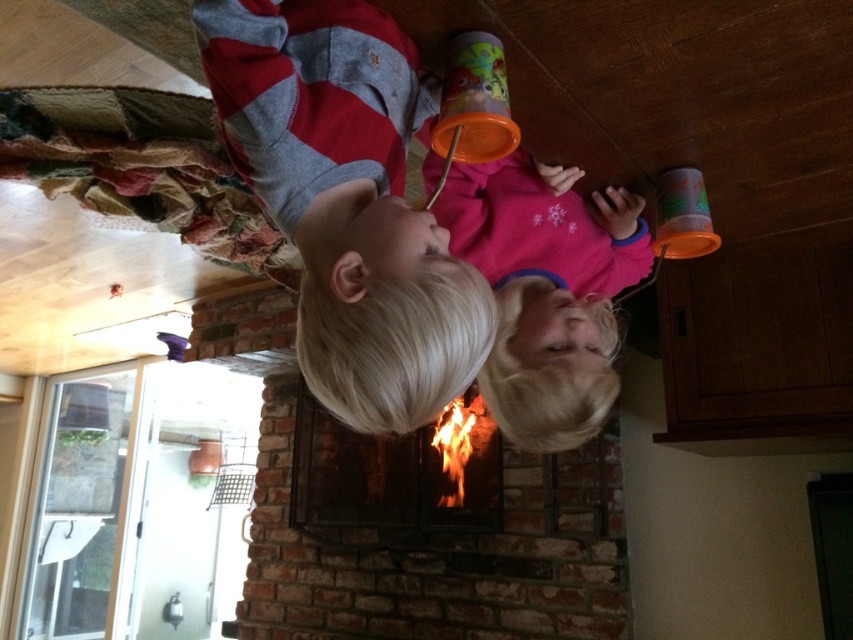
Is point (496, 253) closer to camera compared to point (440, 512)?

Yes, it is in front of point (440, 512).

This screenshot has width=853, height=640. What are the coordinates of `pink fleece sweater at center` in the screenshot? It's located at (546, 291).

Is matte gray sweater at center in front of pink fleece sweater at center?

Yes, matte gray sweater at center is closer to the viewer.

Does matte gray sweater at center appear under pink fleece sweater at center?

Incorrect, matte gray sweater at center is not positioned below pink fleece sweater at center.

Where is `matte gray sweater at center`? The width and height of the screenshot is (853, 640). matte gray sweater at center is located at coordinates (347, 202).

Based on the photo, between matte gray sweater at center and brick fireplace at center, which one is positioned higher?

matte gray sweater at center is higher up.

Is point (357, 294) closer to viewer compared to point (495, 444)?

That is True.

Measure the distance between point (373, 13) and camera.

They are 33.02 inches apart.

Find the location of `matte gray sweater at center`. matte gray sweater at center is located at coordinates (347, 202).